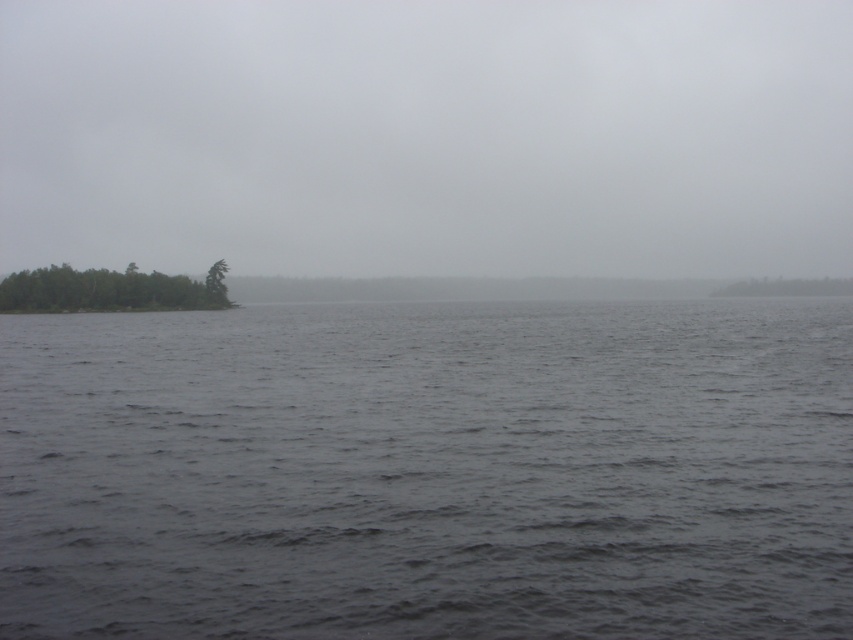
Question: Which object is the farthest from the green matte tree at center?

Choices:
 (A) green leafy trees at left
 (B) green matte tree at right
 (C) gray cloudy sky at upper center

Answer: (C)

Question: Which point appears farthest from the camera in this image?

Choices:
 (A) (439, 560)
 (B) (209, 284)
 (C) (743, 284)

Answer: (C)

Question: Is green matte tree at right further to the viewer compared to green matte tree at center?

Choices:
 (A) yes
 (B) no

Answer: (A)

Question: Based on their relative distances, which object is farther from the green leafy trees at left?

Choices:
 (A) gray cloudy sky at upper center
 (B) dark gray water at center
 (C) green matte tree at right
 (D) green matte tree at center

Answer: (A)

Question: Does gray cloudy sky at upper center have a larger size compared to green matte tree at center?

Choices:
 (A) no
 (B) yes

Answer: (B)

Question: Is the position of green leafy trees at left less distant than that of green matte tree at center?

Choices:
 (A) yes
 (B) no

Answer: (A)